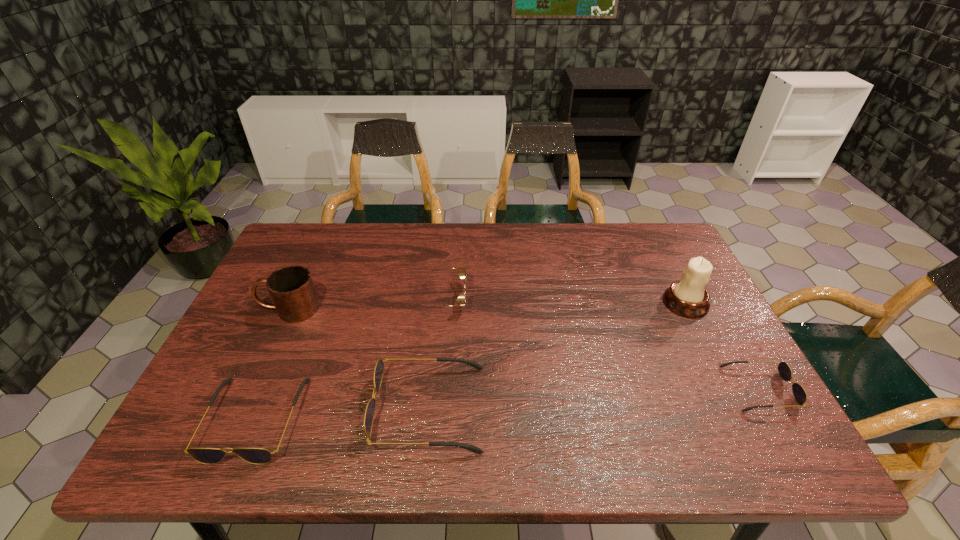
Where is `free space for an extra sunglasses to achieve even spacing`? The image size is (960, 540). free space for an extra sunglasses to achieve even spacing is located at coordinates (597, 399).